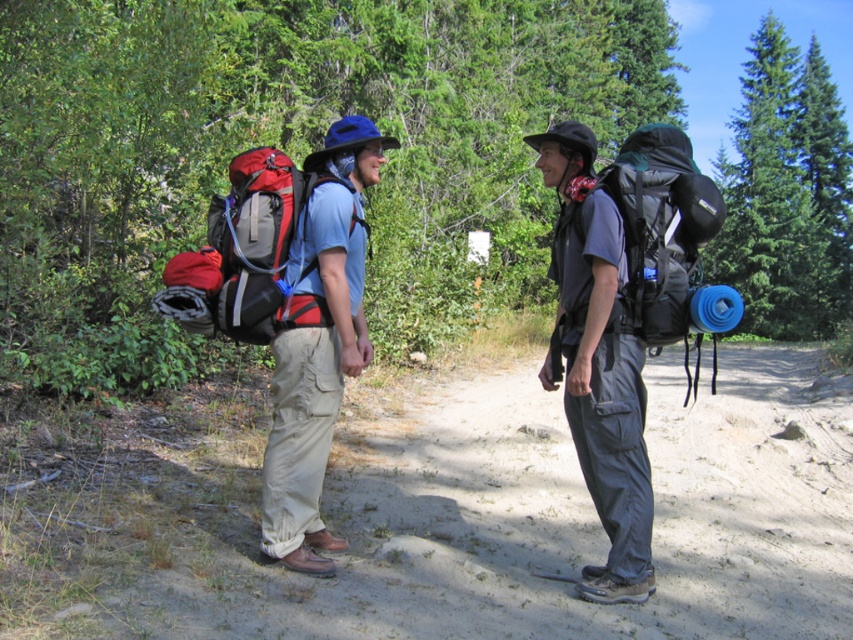
You are planning to carry both the gray fabric backpack at center and the matte black backpack at left on a hike. Which backpack has a smaller width?

The gray fabric backpack at center has a smaller width than the matte black backpack at left.

You are a hiker trying to navigate through the forest. You see two points marked on the map corresponding to coordinates point (560, 196) and point (311, 456). Which point is closer to your current position?

Point (560, 196) is further to the viewer than point (311, 456), so the closer point to your current position would be point (311, 456).